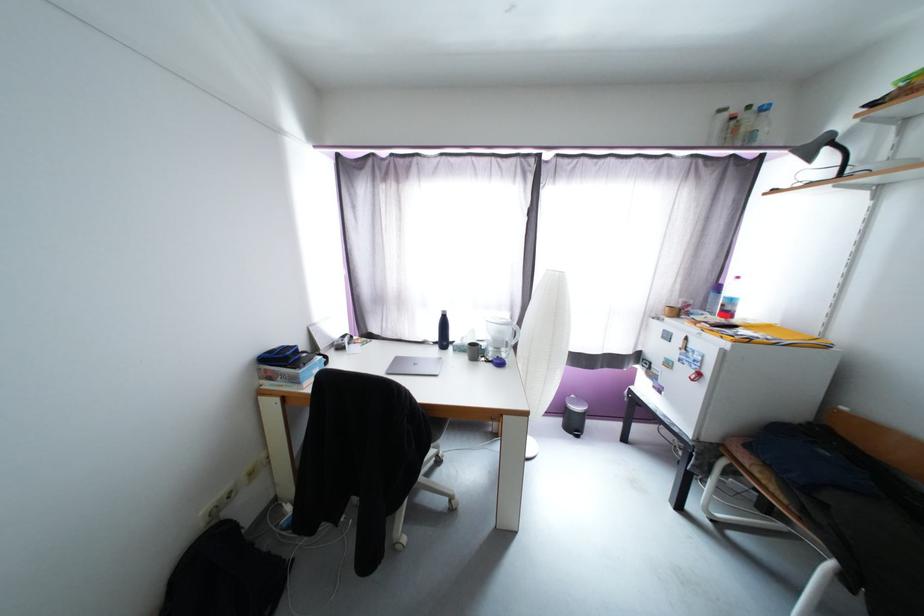
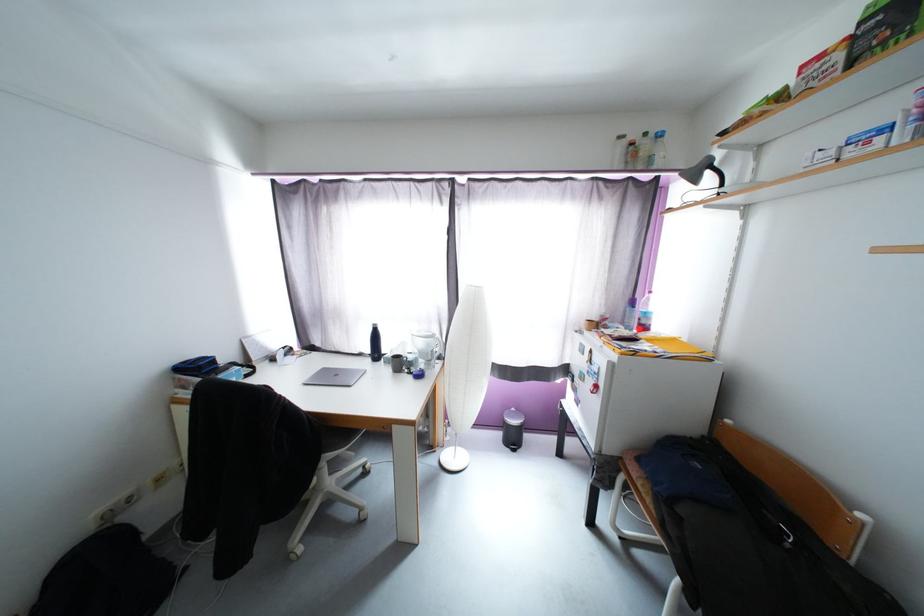
Where in the second image is the point corresponding to point 565,423 from the first image?

(505, 437)